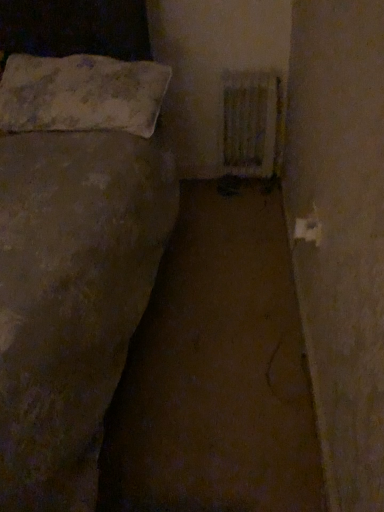
Question: From the image's perspective, relative to white textured pillow at upper left, is white textured radiator at upper right above or below?

Choices:
 (A) below
 (B) above

Answer: (A)

Question: From their relative heights in the image, would you say white textured radiator at upper right is taller or shorter than white textured pillow at upper left?

Choices:
 (A) tall
 (B) short

Answer: (A)

Question: Does point (248, 102) appear closer or farther from the camera than point (105, 82)?

Choices:
 (A) closer
 (B) farther

Answer: (B)

Question: From a real-world perspective, is white textured pillow at upper left physically located above or below white textured radiator at upper right?

Choices:
 (A) below
 (B) above

Answer: (B)

Question: From the image's perspective, is white textured pillow at upper left above or below white textured radiator at upper right?

Choices:
 (A) above
 (B) below

Answer: (A)

Question: In the image, is white textured pillow at upper left positioned in front of or behind white textured radiator at upper right?

Choices:
 (A) front
 (B) behind

Answer: (A)

Question: In terms of height, does white textured pillow at upper left look taller or shorter compared to white textured radiator at upper right?

Choices:
 (A) tall
 (B) short

Answer: (B)